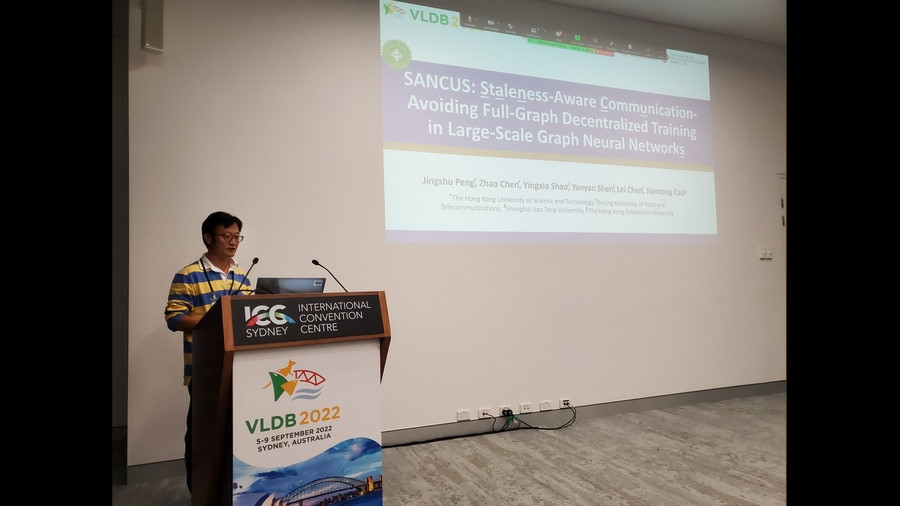
Locate an element on the screen. speaker is located at coordinates (207, 275).